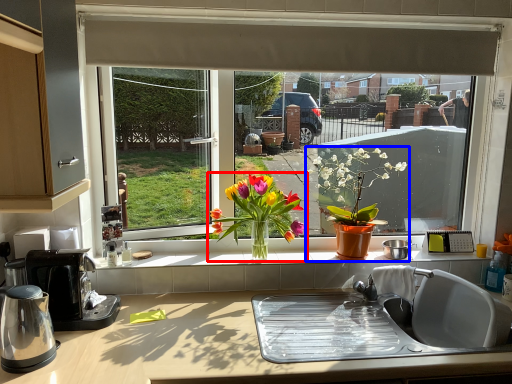
Question: Which object appears closest to the camera in this image, houseplant (highlighted by a red box) or houseplant (highlighted by a blue box)?

Choices:
 (A) houseplant
 (B) houseplant

Answer: (A)